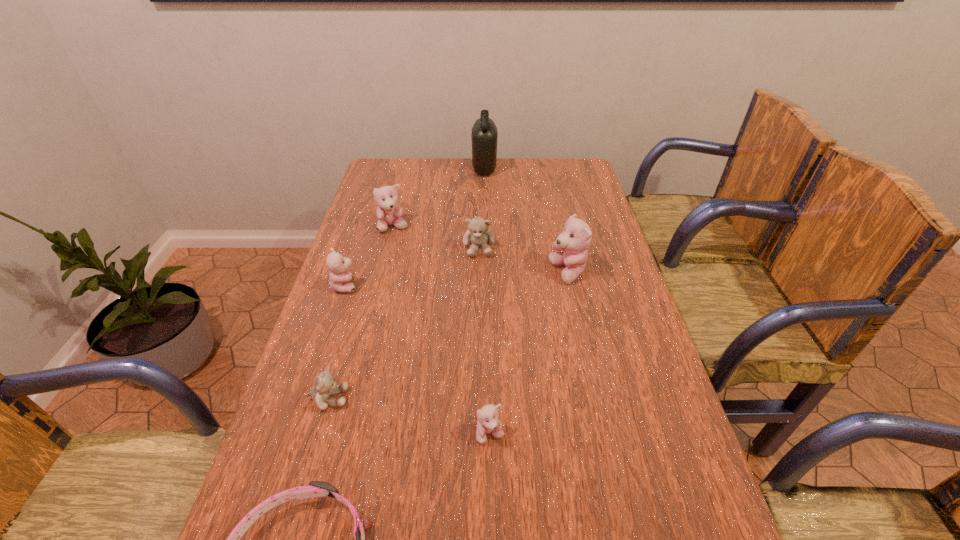
Find the location of `the closest pink teddy bear to the rightmost teddy bear`. the closest pink teddy bear to the rightmost teddy bear is located at coordinates (488, 423).

The height and width of the screenshot is (540, 960). What are the coordinates of `free spot that satisfies the following two spatial constraints: 1. at the face of the tallest teddy bear; 2. at the face of the nearest pink teddy bear` in the screenshot? It's located at tap(604, 434).

Find the location of a particular element. The width and height of the screenshot is (960, 540). vacant position in the image that satisfies the following two spatial constraints: 1. at the face of the rightmost teddy bear; 2. at the face of the second nearest object is located at coordinates (604, 434).